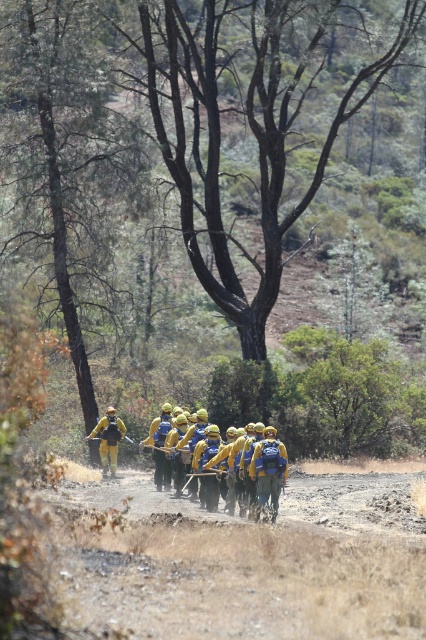
Does yellow fabric uniform at center have a greater width compared to yellow reflective uniform at center?

Yes.

Is point (215, 436) more distant than point (101, 440)?

No, (215, 436) is closer to viewer.

The width and height of the screenshot is (426, 640). I want to click on yellow fabric uniform at center, so click(265, 465).